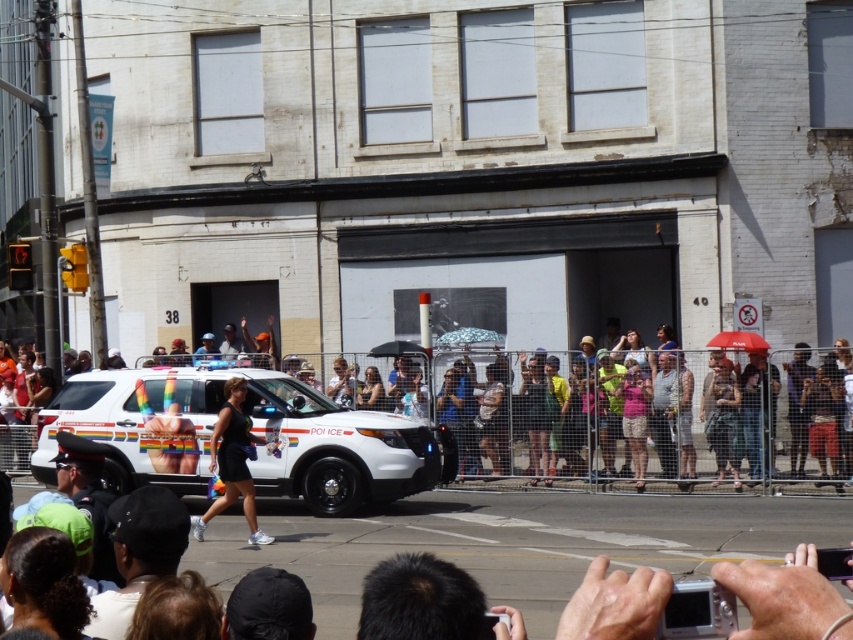
Can you confirm if matte white crowd at center is bigger than white glossy police car at center?

Yes, matte white crowd at center is bigger than white glossy police car at center.

Does matte white crowd at center have a greater height compared to white glossy police car at center?

Yes, matte white crowd at center is taller than white glossy police car at center.

Between point (437, 378) and point (395, 483), which one is positioned in front?

Point (395, 483) is in front.

Where is `matte white crowd at center`? This screenshot has width=853, height=640. matte white crowd at center is located at coordinates (590, 412).

Can you confirm if matte white crowd at center is positioned above black matte dress at center?

Yes, matte white crowd at center is above black matte dress at center.

Which is more to the left, matte white crowd at center or black matte dress at center?

black matte dress at center is more to the left.

Does point (329, 397) lie in front of point (241, 416)?

No.

Identify the location of matte white crowd at center. This screenshot has width=853, height=640. (590, 412).

Locate an element on the screen. white glossy police car at center is located at coordinates (251, 429).

Looking at this image, does white glossy police car at center have a lesser height compared to black matte dress at center?

No, white glossy police car at center is not shorter than black matte dress at center.

Locate an element on the screen. This screenshot has height=640, width=853. white glossy police car at center is located at coordinates (251, 429).